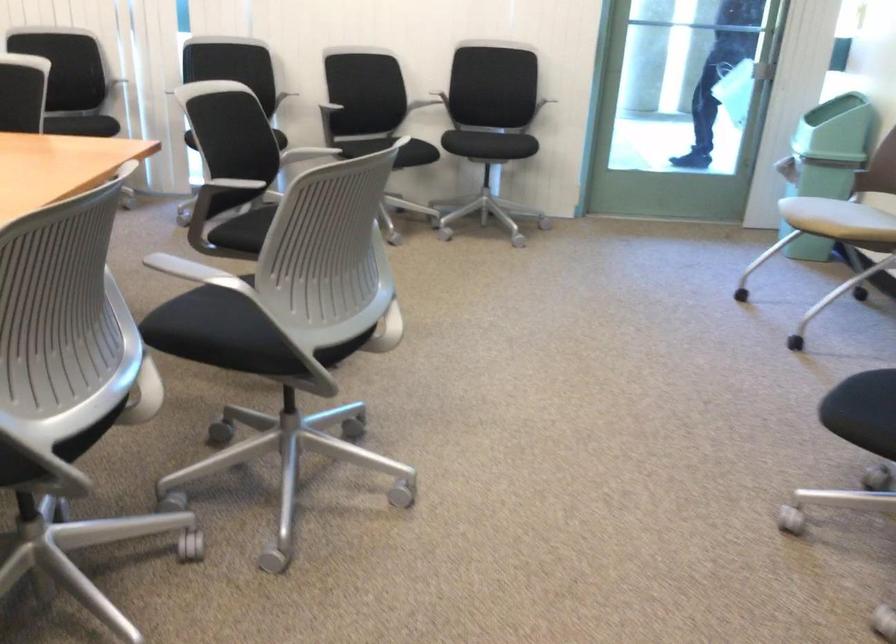
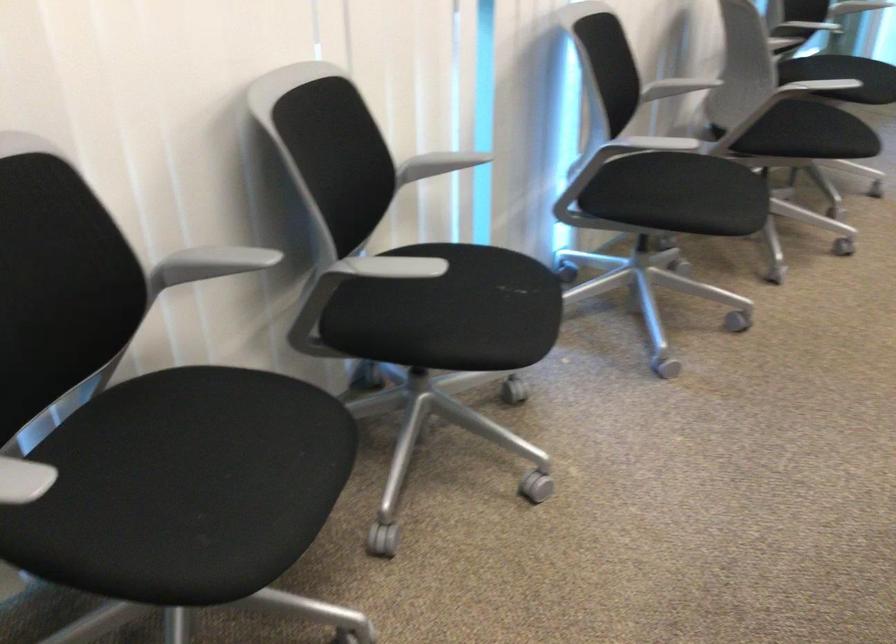
The point at (340, 133) is marked in the first image. Where is the corresponding point in the second image?

(810, 134)